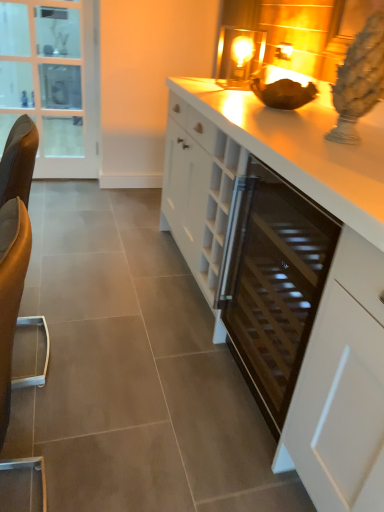
Question: Does white matte cabinet at center have a lesser width compared to black glass wine cooler at center?

Choices:
 (A) no
 (B) yes

Answer: (B)

Question: Can you confirm if white matte cabinet at center is smaller than black glass wine cooler at center?

Choices:
 (A) no
 (B) yes

Answer: (B)

Question: Considering the relative sizes of white matte cabinet at center and black glass wine cooler at center in the image provided, is white matte cabinet at center shorter than black glass wine cooler at center?

Choices:
 (A) no
 (B) yes

Answer: (A)

Question: From a real-world perspective, is white matte cabinet at center over black glass wine cooler at center?

Choices:
 (A) yes
 (B) no

Answer: (A)

Question: Is white matte cabinet at center turned away from black glass wine cooler at center?

Choices:
 (A) yes
 (B) no

Answer: (B)

Question: In the image, is white glossy countertop at center on the left side or the right side of black glass wine cooler at center?

Choices:
 (A) left
 (B) right

Answer: (A)

Question: In terms of width, does white glossy countertop at center look wider or thinner when compared to black glass wine cooler at center?

Choices:
 (A) wide
 (B) thin

Answer: (A)

Question: From a real-world perspective, relative to black glass wine cooler at center, is white glossy countertop at center vertically above or below?

Choices:
 (A) below
 (B) above

Answer: (B)

Question: From the image's perspective, is white glossy countertop at center located above or below black glass wine cooler at center?

Choices:
 (A) above
 (B) below

Answer: (A)

Question: Based on their positions, is clear glass door at left located to the left or right of black glass wine cooler at center?

Choices:
 (A) right
 (B) left

Answer: (B)

Question: From the image's perspective, is clear glass door at left located above or below black glass wine cooler at center?

Choices:
 (A) below
 (B) above

Answer: (B)

Question: Considering the positions of clear glass door at left and black glass wine cooler at center in the image, is clear glass door at left wider or thinner than black glass wine cooler at center?

Choices:
 (A) wide
 (B) thin

Answer: (B)

Question: Does point (52, 132) appear closer or farther from the camera than point (218, 295)?

Choices:
 (A) farther
 (B) closer

Answer: (A)

Question: Is white matte cabinet at center inside or outside of clear glass door at left?

Choices:
 (A) outside
 (B) inside

Answer: (A)

Question: Relative to clear glass door at left, is white matte cabinet at center in front or behind?

Choices:
 (A) front
 (B) behind

Answer: (A)